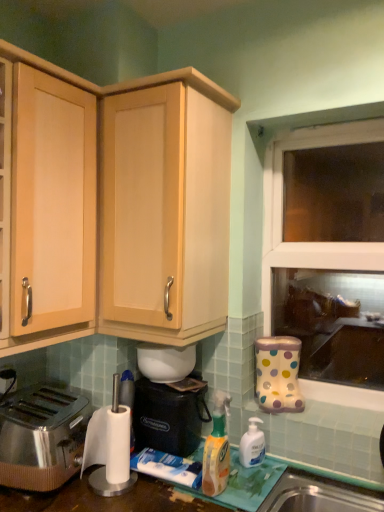
Where is `empty space that is ontop of transparent glass window at right (from a real-world perspective)`? The width and height of the screenshot is (384, 512). empty space that is ontop of transparent glass window at right (from a real-world perspective) is located at coordinates (325, 124).